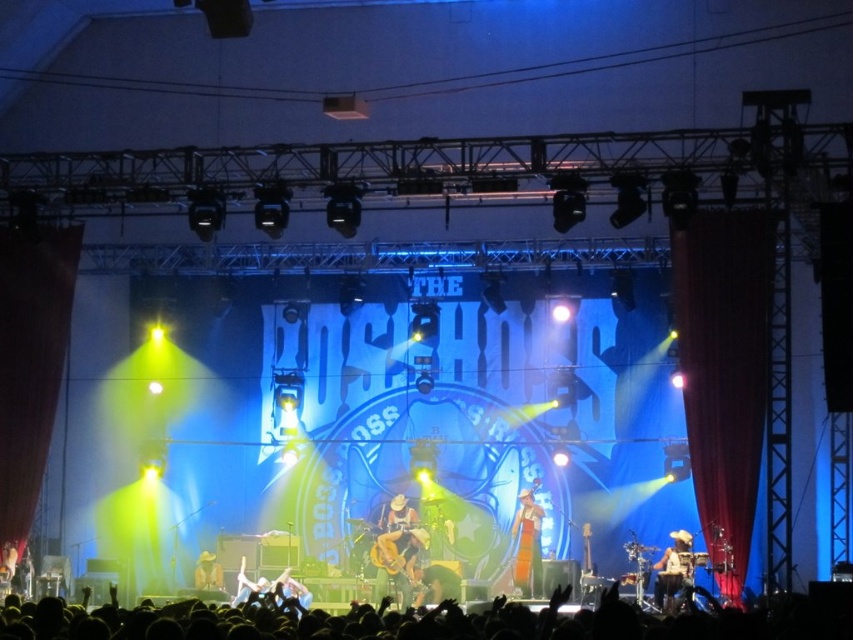
Does wooden acoustic guitar at center have a lesser width compared to shiny metallic cowboy hat at center?

Correct, wooden acoustic guitar at center's width is less than shiny metallic cowboy hat at center's.

Is wooden acoustic guitar at center to the right of shiny metallic cowboy hat at center from the viewer's perspective?

No, wooden acoustic guitar at center is not to the right of shiny metallic cowboy hat at center.

Is point (403, 502) closer to camera compared to point (526, 548)?

That is False.

Locate an element on the screen. The height and width of the screenshot is (640, 853). wooden acoustic guitar at center is located at coordinates (398, 552).

Does wooden acoustic guitar at center have a lesser height compared to yellow fabric hat at center?

Correct, wooden acoustic guitar at center is not as tall as yellow fabric hat at center.

Measure the distance between wooden acoustic guitar at center and camera.

wooden acoustic guitar at center is 66.25 meters from camera.

Which is behind, point (410, 545) or point (196, 573)?

Positioned behind is point (196, 573).

The height and width of the screenshot is (640, 853). I want to click on wooden acoustic guitar at center, so click(398, 552).

Does silhouette crowd at lower center appear on the left side of yellow fabric hat at center?

In fact, silhouette crowd at lower center is to the right of yellow fabric hat at center.

Which is in front, point (763, 611) or point (215, 584)?

Point (763, 611) is more forward.

At what (x,y) coordinates should I click in order to perform the action: click on silhouette crowd at lower center. Please return your answer as a coordinate pair (x, y). This screenshot has height=640, width=853. Looking at the image, I should click on (428, 621).

Image resolution: width=853 pixels, height=640 pixels. I want to click on silhouette crowd at lower center, so pyautogui.click(x=428, y=621).